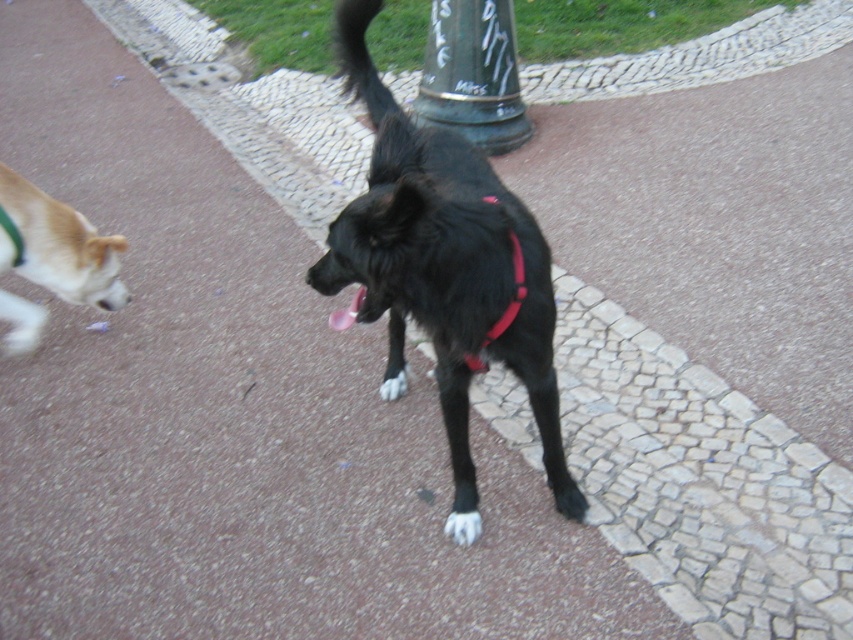
Question: Can you confirm if light brown fur at left is wider than red fabric neckband at center?

Choices:
 (A) yes
 (B) no

Answer: (A)

Question: Based on their relative distances, which object is farther from the light brown fur at left?

Choices:
 (A) black fur dog at center
 (B) black fur tail at upper center
 (C) pink fabric at center
 (D) red fabric neckband at center

Answer: (D)

Question: Estimate the real-world distances between objects in this image. Which object is closer to the light brown fur at left?

Choices:
 (A) black fur dog at center
 (B) pink fabric at center
 (C) green painted metal pole at center

Answer: (B)

Question: Is the position of black fur tail at upper center less distant than that of red fabric neckband at center?

Choices:
 (A) no
 (B) yes

Answer: (A)

Question: Which of the following is the closest to the observer?

Choices:
 (A) (344, 314)
 (B) (471, 225)
 (C) (358, 19)
 (D) (426, 42)

Answer: (B)

Question: Is light brown fur at left further to camera compared to pink fabric at center?

Choices:
 (A) yes
 (B) no

Answer: (A)